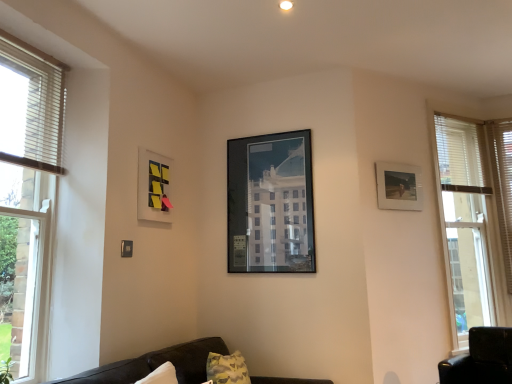
Identify the location of matte glass picture frame at center, which is the 2th picture frame in right-to-left order. The width and height of the screenshot is (512, 384). (271, 204).

At what (x,y) coordinates should I click in order to perform the action: click on clear glass window at left. Please return your answer as a coordinate pair (x, y). Image resolution: width=512 pixels, height=384 pixels. Looking at the image, I should click on (27, 199).

Measure the distance between white textured blind at right, which appears as the first blind when viewed from the right, and camera.

white textured blind at right, which appears as the first blind when viewed from the right, and camera are 3.10 meters apart from each other.

What do you see at coordinates (156, 364) in the screenshot? The width and height of the screenshot is (512, 384). I see `dark brown leather couch at lower center` at bounding box center [156, 364].

Locate an element on the screen. Image resolution: width=512 pixels, height=384 pixels. white wood blinds at left, acting as the first blind starting from the front is located at coordinates (37, 105).

Identify the location of matte glass picture frame at center, which is the 2th picture frame in right-to-left order. The width and height of the screenshot is (512, 384). (x=271, y=204).

Is white textured blind at right, the 2th blind viewed from the front, oriented towards matte wooden picture frame at right, placed as the 3th picture frame when sorted from left to right?

No, white textured blind at right, the 2th blind viewed from the front, does not turn towards matte wooden picture frame at right, placed as the 3th picture frame when sorted from left to right.

Considering the relative sizes of white textured blind at right, acting as the 1th blind starting from the back, and matte wooden picture frame at right, placed as the 3th picture frame when sorted from left to right, in the image provided, is white textured blind at right, acting as the 1th blind starting from the back, shorter than matte wooden picture frame at right, placed as the 3th picture frame when sorted from left to right,?

No.

Consider the image. From a real-world perspective, which is physically above, white textured blind at right, the 2th blind viewed from the front, or matte wooden picture frame at right, which is counted as the first picture frame, starting from the right?

matte wooden picture frame at right, which is counted as the first picture frame, starting from the right, from a real-world perspective.

From the picture: From the image's perspective, is white textured blind at right, the 2th blind viewed from the front, positioned above or below matte wooden picture frame at right, which is counted as the first picture frame, starting from the right?

white textured blind at right, the 2th blind viewed from the front, is below matte wooden picture frame at right, which is counted as the first picture frame, starting from the right.

Based on the photo, considering the sizes of objects matte glass picture frame at center, the second picture frame from the left, and white textured blind at right, the 2th blind viewed from the front, in the image provided, who is taller, matte glass picture frame at center, the second picture frame from the left, or white textured blind at right, the 2th blind viewed from the front,?

Standing taller between the two is white textured blind at right, the 2th blind viewed from the front.

Can you confirm if matte glass picture frame at center, the second picture frame from the left, is positioned to the left of white textured blind at right, which appears as the first blind when viewed from the right?

Correct, you'll find matte glass picture frame at center, the second picture frame from the left, to the left of white textured blind at right, which appears as the first blind when viewed from the right.

Based on the photo, are matte glass picture frame at center, the second picture frame from the left, and white textured blind at right, which ranks as the second blind in left-to-right order, making contact?

matte glass picture frame at center, the second picture frame from the left, and white textured blind at right, which ranks as the second blind in left-to-right order, are clearly separated.

Where is `blind lying behind the matte glass picture frame at center, which is the 2th picture frame in right-to-left order`? The height and width of the screenshot is (384, 512). blind lying behind the matte glass picture frame at center, which is the 2th picture frame in right-to-left order is located at coordinates (502, 185).

From a real-world perspective, between white textured blind at right, which ranks as the second blind in left-to-right order, and matte glass picture frame at center, the second picture frame from the left, who is vertically higher?

matte glass picture frame at center, the second picture frame from the left, from a real-world perspective.

Is white textured blind at right, the 2th blind viewed from the front, aimed at matte glass picture frame at center, the second picture frame from the left?

No, white textured blind at right, the 2th blind viewed from the front, is not oriented towards matte glass picture frame at center, the second picture frame from the left.

I want to click on the 2nd picture frame to the left of the white textured blind at right, which appears as the first blind when viewed from the right, starting your count from the anchor, so click(271, 204).

Is point (508, 172) closer or farther from the camera than point (278, 194)?

Point (508, 172) is farther from the camera than point (278, 194).

You are a GUI agent. You are given a task and a screenshot of the screen. Output one action in this format:
    pyautogui.click(x=<x>, y=<y>)
    Task: Click on the studio couch that is under the matte wooden picture frame at right, which is counted as the first picture frame, starting from the right (from a real-world perspective)
    The width and height of the screenshot is (512, 384).
    Given the screenshot: What is the action you would take?
    pyautogui.click(x=156, y=364)

Considering the positions of points (405, 194) and (194, 345), is point (405, 194) farther from camera compared to point (194, 345)?

Yes, it is behind point (194, 345).

From a real-world perspective, is matte wooden picture frame at right, which is counted as the first picture frame, starting from the right, over dark brown leather couch at lower center?

Yes.

Based on the photo, which of these two, white textured blind at right, which ranks as the second blind in left-to-right order, or white wood blinds at left, marked as the second blind in a back-to-front arrangement, is wider?

Wider between the two is white textured blind at right, which ranks as the second blind in left-to-right order.

Which of these two, white textured blind at right, which appears as the first blind when viewed from the right, or white wood blinds at left, acting as the first blind starting from the front, is smaller?

Smaller between the two is white wood blinds at left, acting as the first blind starting from the front.

Locate an element on the screen. Image resolution: width=512 pixels, height=384 pixels. blind on the left of the white textured blind at right, the 2th blind viewed from the front is located at coordinates (37, 105).

How different are the orientations of white textured blind at right, which appears as the first blind when viewed from the right, and white wood blinds at left, acting as the first blind starting from the front, in degrees?

The angular difference between white textured blind at right, which appears as the first blind when viewed from the right, and white wood blinds at left, acting as the first blind starting from the front, is 89.4 degrees.

Does matte plastic picture frame at upper left, acting as the first picture frame starting from the left, come behind white textured blind at right, which appears as the first blind when viewed from the right?

No, matte plastic picture frame at upper left, acting as the first picture frame starting from the left, is closer to the camera.

Considering the points (157, 178) and (508, 183), which point is in front, point (157, 178) or point (508, 183)?

Positioned in front is point (157, 178).

Choose the correct answer: Is matte plastic picture frame at upper left, which appears as the 3th picture frame when viewed from the right, inside white textured blind at right, which ranks as the second blind in left-to-right order, or outside it?

matte plastic picture frame at upper left, which appears as the 3th picture frame when viewed from the right, lies outside white textured blind at right, which ranks as the second blind in left-to-right order.

Considering the positions of objects matte plastic picture frame at upper left, acting as the first picture frame starting from the left, and white textured blind at right, which ranks as the second blind in left-to-right order, in the image provided, who is more to the left, matte plastic picture frame at upper left, acting as the first picture frame starting from the left, or white textured blind at right, which ranks as the second blind in left-to-right order,?

Positioned to the left is matte plastic picture frame at upper left, acting as the first picture frame starting from the left.

Is white wood blinds at left, arranged as the 2th blind when viewed from the right, positioned far away from matte glass picture frame at center, the second picture frame from the left?

white wood blinds at left, arranged as the 2th blind when viewed from the right, is far away from matte glass picture frame at center, the second picture frame from the left.

Is white wood blinds at left, arranged as the 2th blind when viewed from the right, facing towards matte glass picture frame at center, which is the 2th picture frame in right-to-left order?

No, white wood blinds at left, arranged as the 2th blind when viewed from the right, is not oriented towards matte glass picture frame at center, which is the 2th picture frame in right-to-left order.

In the scene shown: From the image's perspective, is white wood blinds at left, acting as the first blind starting from the front, on matte glass picture frame at center, which is the 2th picture frame in right-to-left order?

Yes, from the image's perspective, white wood blinds at left, acting as the first blind starting from the front, is over matte glass picture frame at center, which is the 2th picture frame in right-to-left order.

Considering the sizes of white wood blinds at left, acting as the first blind starting from the front, and matte glass picture frame at center, which is the 2th picture frame in right-to-left order, in the image, is white wood blinds at left, acting as the first blind starting from the front, taller or shorter than matte glass picture frame at center, which is the 2th picture frame in right-to-left order,?

white wood blinds at left, acting as the first blind starting from the front, is shorter than matte glass picture frame at center, which is the 2th picture frame in right-to-left order.

Identify the location of blind behind the matte wooden picture frame at right, placed as the 3th picture frame when sorted from left to right. (502, 185).

Find the location of a particular element. The image size is (512, 384). blind located underneath the matte glass picture frame at center, which is the 2th picture frame in right-to-left order (from a real-world perspective) is located at coordinates (502, 185).

Which object lies nearer to the anchor point clear glass window at left, matte plastic picture frame at upper left, which appears as the 3th picture frame when viewed from the right, or matte glass picture frame at center, the second picture frame from the left?

Based on the image, matte plastic picture frame at upper left, which appears as the 3th picture frame when viewed from the right, appears to be nearer to clear glass window at left.

Based on their spatial positions, is white wood blinds at left, arranged as the 2th blind when viewed from the right, or clear glass window at left further from matte glass picture frame at center, the second picture frame from the left?

The object further to matte glass picture frame at center, the second picture frame from the left, is clear glass window at left.

Considering their positions, is matte glass picture frame at center, the second picture frame from the left, positioned closer to white textured blind at right, which appears as the first blind when viewed from the right, than dark brown leather couch at lower center?

Among the two, matte glass picture frame at center, the second picture frame from the left, is located nearer to white textured blind at right, which appears as the first blind when viewed from the right.

From the image, which object appears to be nearer to matte wooden picture frame at right, which is counted as the first picture frame, starting from the right, clear glass window at left or matte plastic picture frame at upper left, acting as the first picture frame starting from the left?

matte plastic picture frame at upper left, acting as the first picture frame starting from the left, is positioned closer to the anchor matte wooden picture frame at right, which is counted as the first picture frame, starting from the right.

Estimate the real-world distances between objects in this image. Which object is further from matte plastic picture frame at upper left, acting as the first picture frame starting from the left, white textured blind at right, which ranks as the second blind in left-to-right order, or dark brown leather couch at lower center?

white textured blind at right, which ranks as the second blind in left-to-right order, is further to matte plastic picture frame at upper left, acting as the first picture frame starting from the left.

Looking at this image, from the image, which object appears to be nearer to clear glass window at left, matte wooden picture frame at right, placed as the 3th picture frame when sorted from left to right, or matte glass picture frame at center, which is the 2th picture frame in right-to-left order?

The object closer to clear glass window at left is matte glass picture frame at center, which is the 2th picture frame in right-to-left order.

From the image, which object appears to be nearer to white wood blinds at left, arranged as the 2th blind when viewed from the right, matte plastic picture frame at upper left, acting as the first picture frame starting from the left, or white textured blind at right, the 2th blind viewed from the front?

Among the two, matte plastic picture frame at upper left, acting as the first picture frame starting from the left, is located nearer to white wood blinds at left, arranged as the 2th blind when viewed from the right.

From the picture: Based on their spatial positions, is white wood blinds at left, arranged as the 2th blind when viewed from the right, or matte glass picture frame at center, the second picture frame from the left, further from clear glass window at left?

The object further to clear glass window at left is matte glass picture frame at center, the second picture frame from the left.

Find the location of a particular element. This screenshot has width=512, height=384. studio couch located between clear glass window at left and white textured blind at right, the 2th blind viewed from the front, in the left-right direction is located at coordinates (156, 364).

What are the coordinates of `studio couch situated between matte plastic picture frame at upper left, acting as the first picture frame starting from the left, and matte wooden picture frame at right, which is counted as the first picture frame, starting from the right, from left to right` in the screenshot? It's located at (156, 364).

What are the coordinates of `picture frame between matte plastic picture frame at upper left, acting as the first picture frame starting from the left, and matte wooden picture frame at right, placed as the 3th picture frame when sorted from left to right` in the screenshot? It's located at (271, 204).

Where is `blind between clear glass window at left and white textured blind at right, the 2th blind viewed from the front, from left to right`? The height and width of the screenshot is (384, 512). blind between clear glass window at left and white textured blind at right, the 2th blind viewed from the front, from left to right is located at coordinates (37, 105).